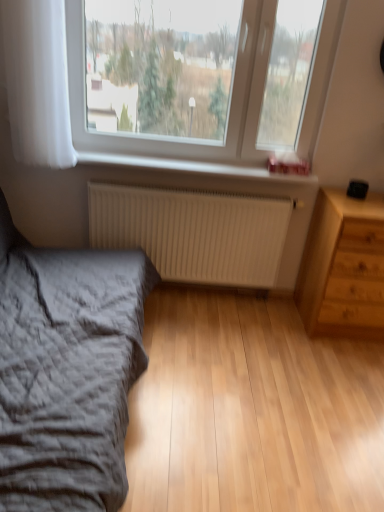
Where is `vacant space positioned to the left of light brown wood chest of drawers at right`? This screenshot has width=384, height=512. vacant space positioned to the left of light brown wood chest of drawers at right is located at coordinates (271, 332).